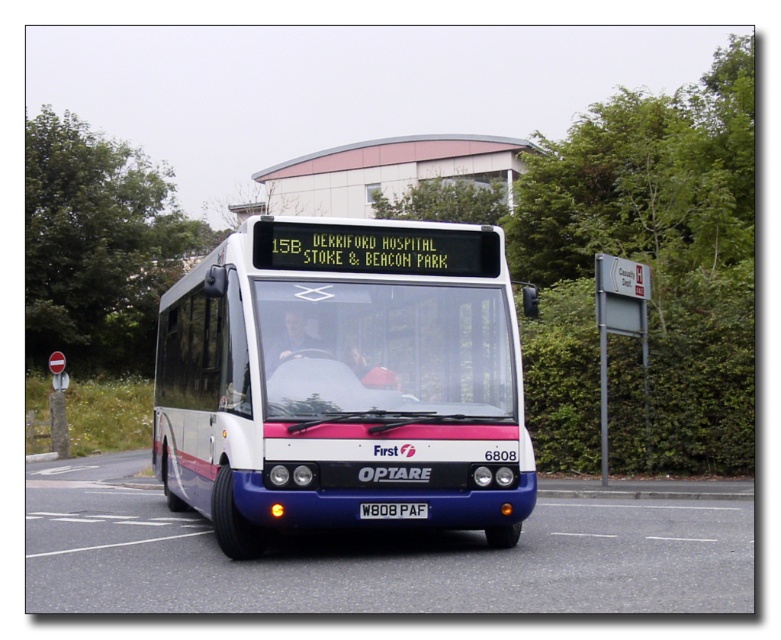
You are a pedestrian standing on the sidewalk next to the road. You see the white glossy bus at center and the metal sign at right. Which object is closer to you?

The white glossy bus at center is closer to you because it is in front of the metal sign at right.

You are a pedestrian standing on the sidewalk. You see the white glossy bus at center and the metal sign at right. Which object is higher from the ground?

The white glossy bus at center is located above the metal sign at right, so it is higher from the ground.